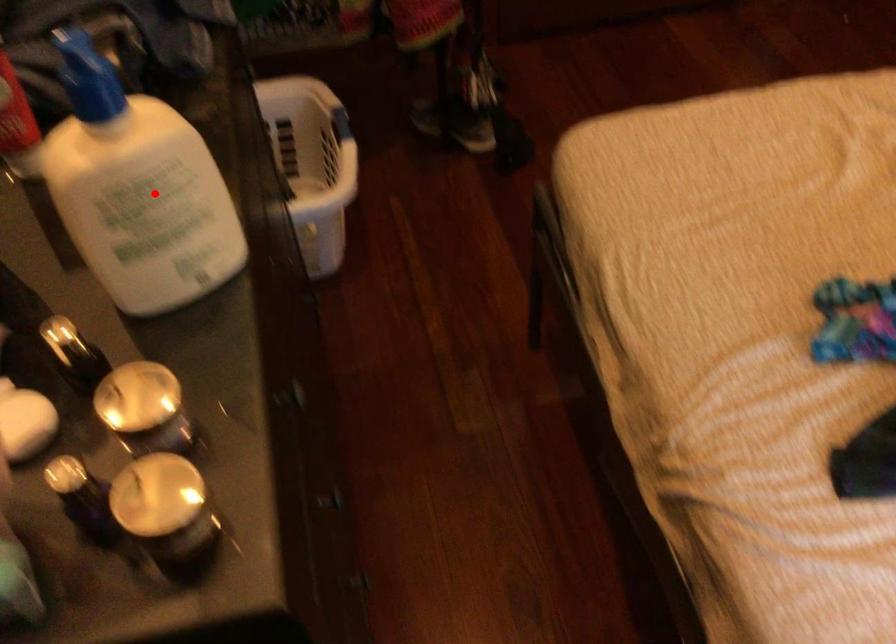
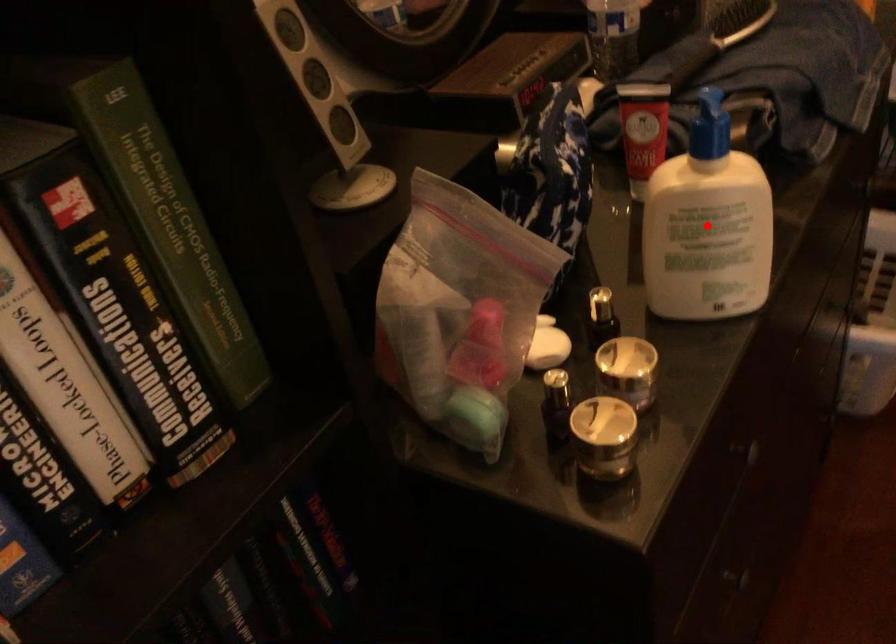
I am providing you with two images of the same scene from different viewpoints. A red point is marked on the first image and another point is marked on the second image. Do the highlighted points in image1 and image2 indicate the same real-world spot?

Yes